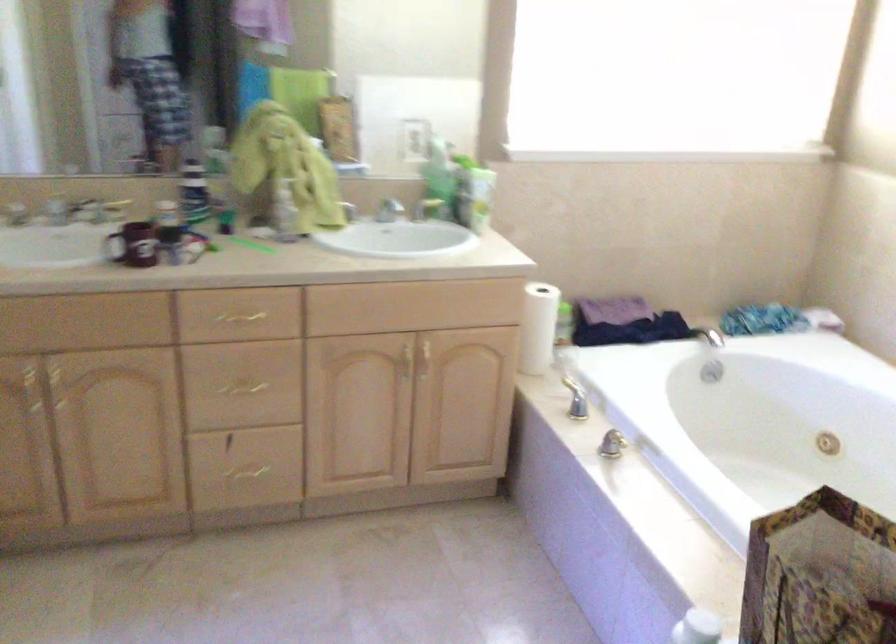
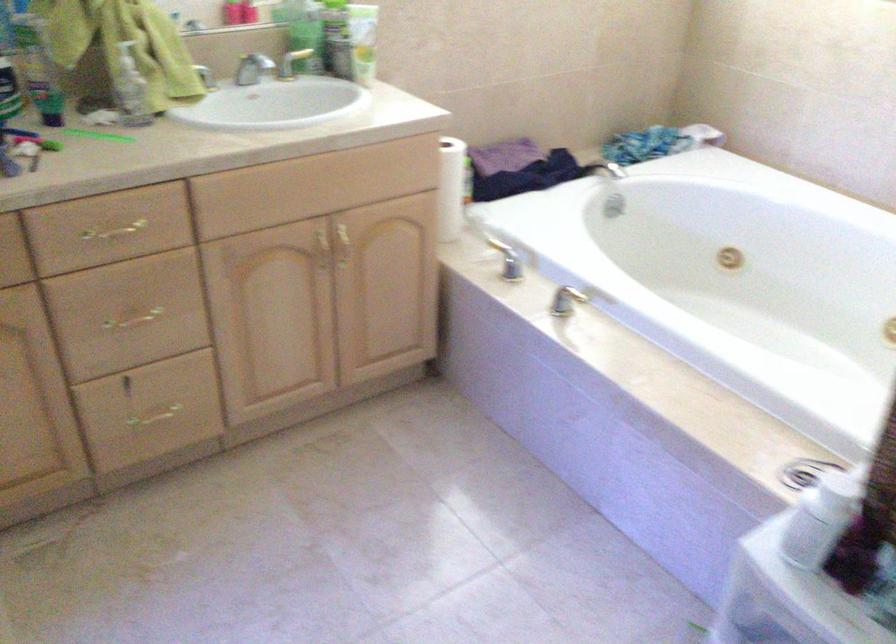
Where in the second image is the point corresponding to point (240, 386) from the first image?

(133, 317)